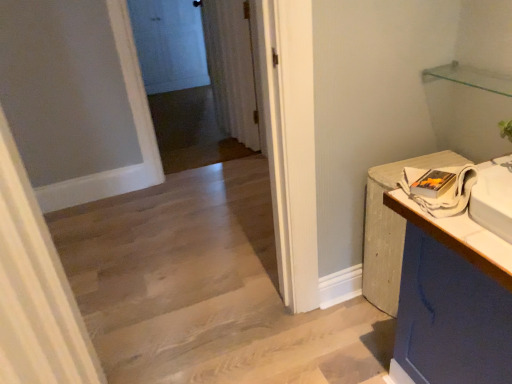
Question: Considering the relative positions of white wood counter at right and white glossy door at upper center in the image provided, is white wood counter at right to the right of white glossy door at upper center from the viewer's perspective?

Choices:
 (A) no
 (B) yes

Answer: (B)

Question: Could you tell me if white wood counter at right is turned towards white glossy door at upper center?

Choices:
 (A) yes
 (B) no

Answer: (B)

Question: Is white wood counter at right further to camera compared to white glossy door at upper center?

Choices:
 (A) yes
 (B) no

Answer: (B)

Question: From the image's perspective, is white wood counter at right below white glossy door at upper center?

Choices:
 (A) no
 (B) yes

Answer: (B)

Question: Does white wood counter at right have a greater width compared to white glossy door at upper center?

Choices:
 (A) yes
 (B) no

Answer: (A)

Question: Considering the relative sizes of white wood counter at right and white glossy door at upper center in the image provided, is white wood counter at right taller than white glossy door at upper center?

Choices:
 (A) no
 (B) yes

Answer: (A)

Question: From a real-world perspective, is white sheer curtain at center, the 2th curtain from the bottom, below white glossy door at upper center?

Choices:
 (A) yes
 (B) no

Answer: (B)

Question: From the image's perspective, is white sheer curtain at center, the 2th curtain in the front-to-back sequence, below white glossy door at upper center?

Choices:
 (A) no
 (B) yes

Answer: (B)

Question: Could you tell me if white sheer curtain at center, positioned as the first curtain in top-to-bottom order, is turned towards white glossy door at upper center?

Choices:
 (A) no
 (B) yes

Answer: (A)

Question: Is there a large distance between white sheer curtain at center, the 2th curtain from the bottom, and white glossy door at upper center?

Choices:
 (A) yes
 (B) no

Answer: (A)

Question: Can you confirm if white sheer curtain at center, the 2th curtain in the front-to-back sequence, is taller than white glossy door at upper center?

Choices:
 (A) yes
 (B) no

Answer: (B)

Question: Is white sheer curtain at center, the 2th curtain from the bottom, shorter than white glossy door at upper center?

Choices:
 (A) yes
 (B) no

Answer: (A)

Question: From the image's perspective, would you say white textured curtain at left, acting as the second curtain starting from the top, is positioned over white wood counter at right?

Choices:
 (A) no
 (B) yes

Answer: (A)